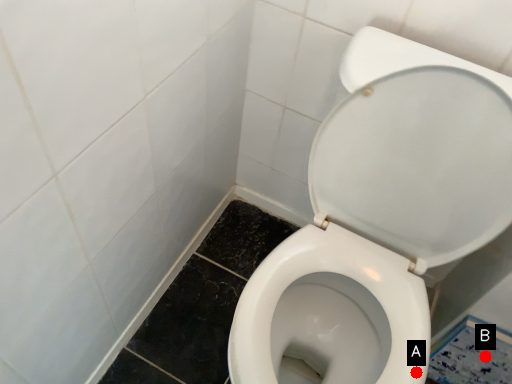
Question: Two points are circled on the image, labeled by A and B beside each circle. Which point is farther from the camera taking this photo?

Choices:
 (A) A is further
 (B) B is further

Answer: (B)